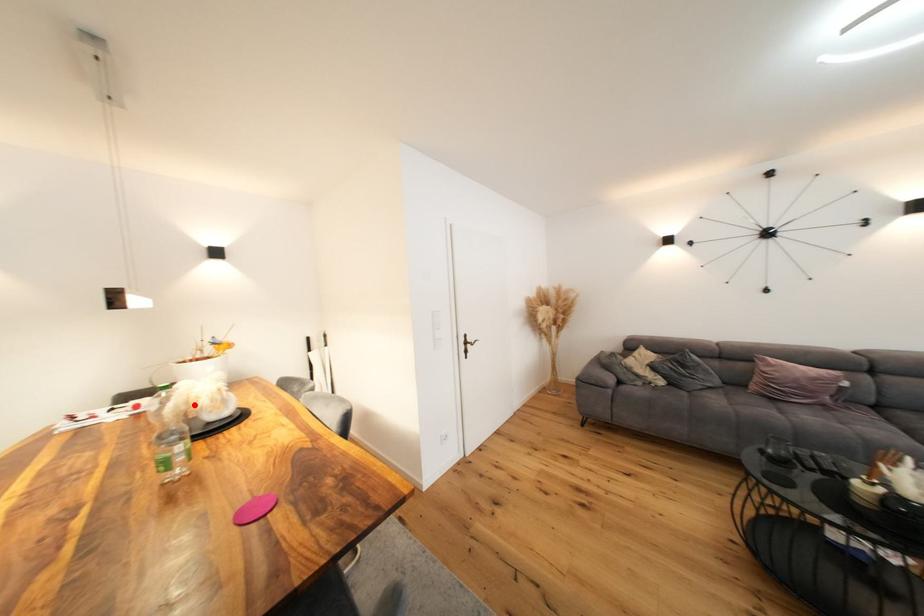
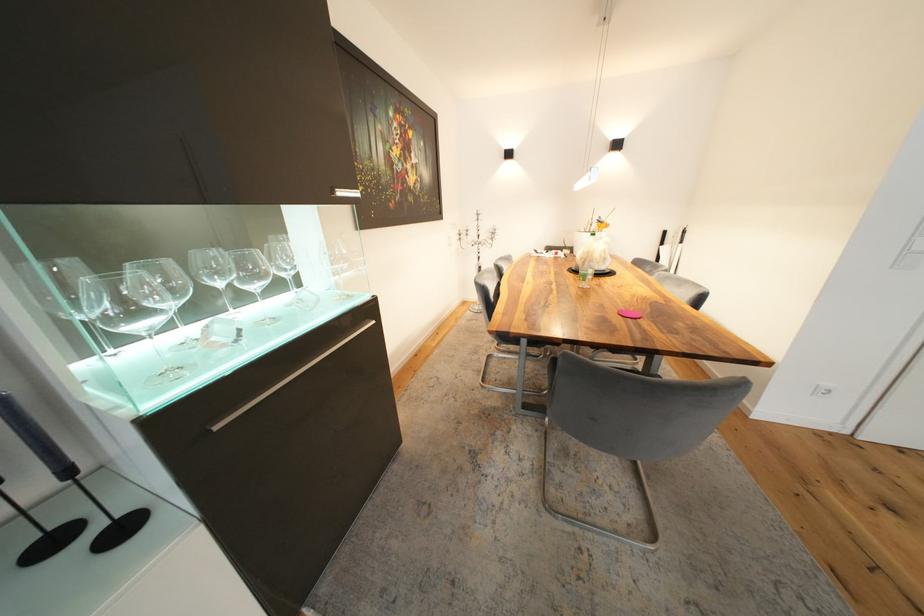
Question: A red point is marked in image1. In image2, is the corresponding 3D point closer to the camera or farther? Reply with the corresponding letter.

Choices:
 (A) The corresponding 3D point is closer.
 (B) The corresponding 3D point is farther.

Answer: (A)